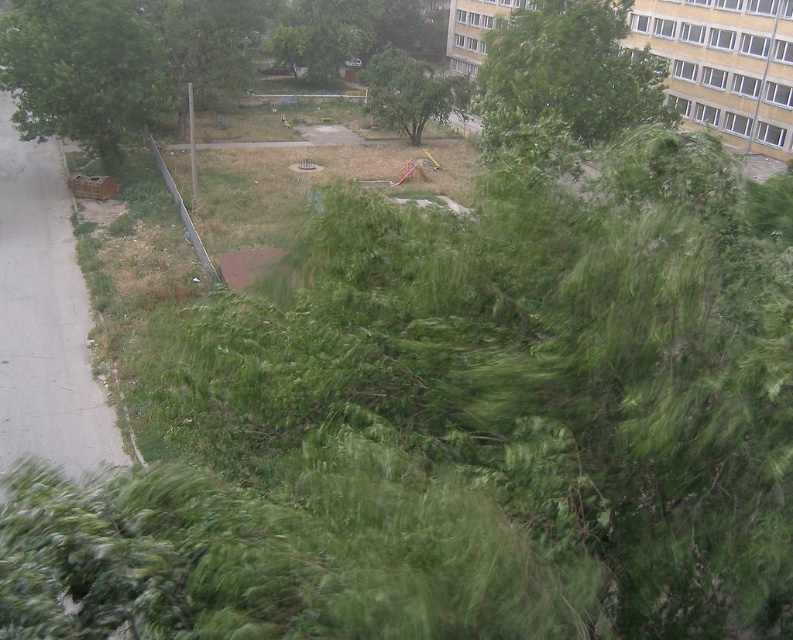
You are a city planner analyzing the image of a windy park. You notice two green leafy trees in the scene. Which tree, the green leafy tree at upper center or the green leafy tree at center, has a wider spread of branches and leaves?

The green leafy tree at upper center has a wider spread of branches and leaves compared to the green leafy tree at center, as its width surpasses the latter.